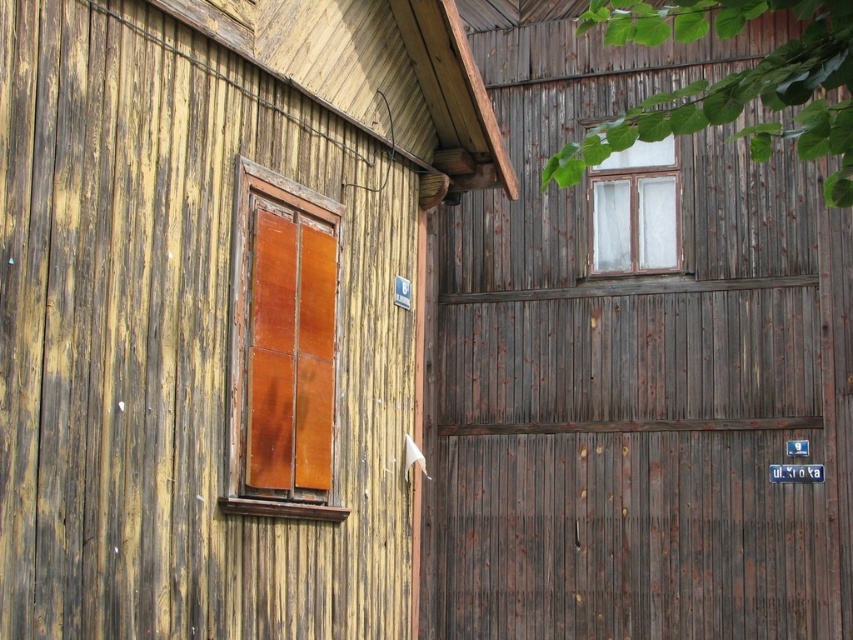
You are an architect assessing the structural integrity of the wooden panel at left and the transparent glass window at upper center. Which object has a smaller width?

The wooden panel at left has a smaller width than the transparent glass window at upper center according to the description.

You are a contractor assessing the building. You need to replace the wooden panel at left and the transparent glass window at upper center. Which one requires more material due to its size?

The wooden panel at left requires more material because it is bigger than the transparent glass window at upper center.